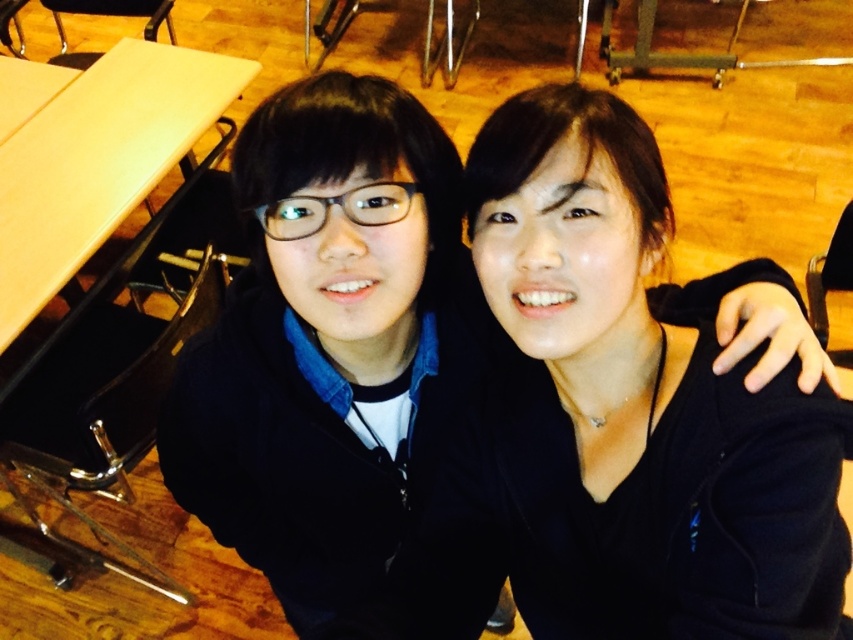
Measure the distance between black matte jacket at center and camera.

A distance of 25.12 inches exists between black matte jacket at center and camera.

Locate an element on the screen. black matte jacket at center is located at coordinates (635, 401).

Where is `black matte jacket at center`? The width and height of the screenshot is (853, 640). black matte jacket at center is located at coordinates (635, 401).